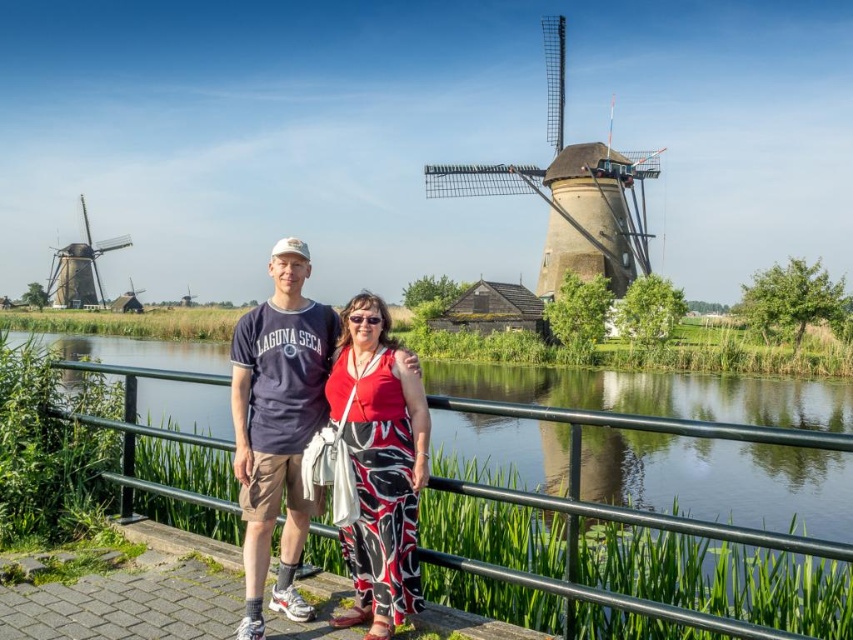
Based on the photo, you are standing on the pathway and want to reach the water to take a photo. The green metal railing at center is in your way. Where is the railing located relative to your position?

The green metal railing at center is located at point 0.889 on the x axis and 0.737 on the y axis, so it is to your right and slightly forward from your current position.

You are a photographer trying to capture the printed fabric couple at center in the image. Based on their position, which direction should you move your camera to focus on them?

The printed fabric couple at center is located at point (x=277, y=424), so you should move the camera slightly to the right and down to focus on them.